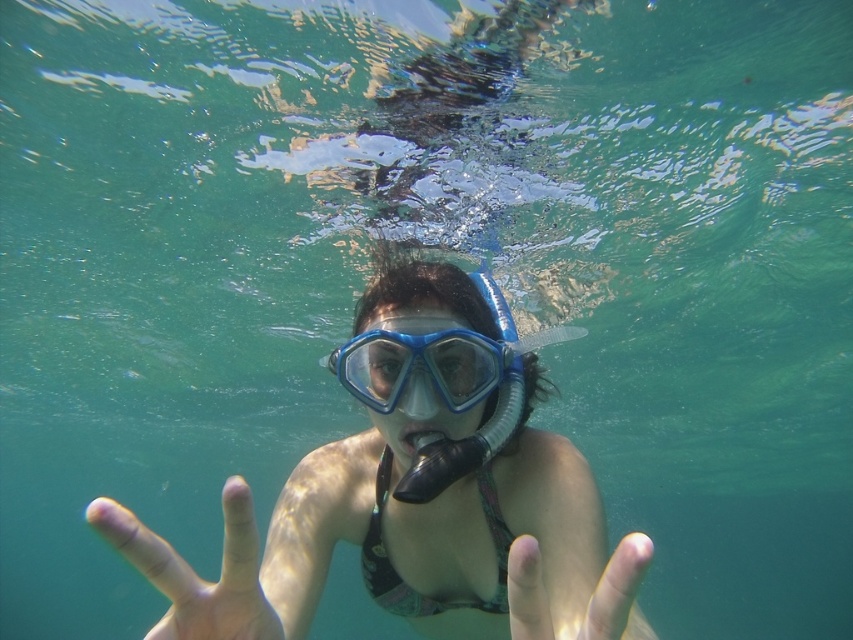
You are a photographer trying to capture the exact location of the point at coordinates point (202, 579) in the underwater scene. Based on the description, where would this point be located on the person?

The point (202, 579) is on the pale skin at center.

You are a photographer capturing an underwater scene. You notice the pale skin at center in the image. Based on its coordinates, where exactly is the pale skin located in the frame?

The pale skin at center is located at the coordinates point (202, 579) in the frame.

Based on the scene described, can you determine the position of the pale skin at center relative to the smooth skin hand at center?

The pale skin at center is located below the smooth skin hand at center.